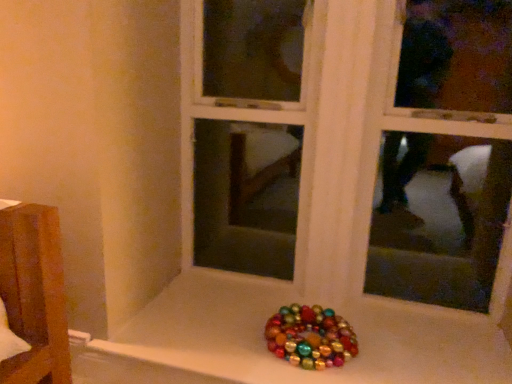
Measure the distance between point (346, 322) and camera.

Point (346, 322) is 5.42 feet from camera.

Where is `multicolored glossy beads at bottom center`? multicolored glossy beads at bottom center is located at coordinates (310, 337).

Describe the element at coordinates (310, 337) in the screenshot. The width and height of the screenshot is (512, 384). I see `multicolored glossy beads at bottom center` at that location.

The width and height of the screenshot is (512, 384). Describe the element at coordinates (342, 143) in the screenshot. I see `metallic shiny ornaments at bottom` at that location.

What is the approximate height of metallic shiny ornaments at bottom?

metallic shiny ornaments at bottom is 1.23 meters tall.

At what (x,y) coordinates should I click in order to perform the action: click on metallic shiny ornaments at bottom. Please return your answer as a coordinate pair (x, y). Looking at the image, I should click on (342, 143).

In order to click on multicolored glossy beads at bottom center in this screenshot , I will do `click(310, 337)`.

Considering the relative positions of multicolored glossy beads at bottom center and metallic shiny ornaments at bottom in the image provided, is multicolored glossy beads at bottom center to the left of metallic shiny ornaments at bottom from the viewer's perspective?

Indeed, multicolored glossy beads at bottom center is positioned on the left side of metallic shiny ornaments at bottom.

Considering the relative positions of multicolored glossy beads at bottom center and metallic shiny ornaments at bottom in the image provided, is multicolored glossy beads at bottom center behind metallic shiny ornaments at bottom?

Yes, it is behind metallic shiny ornaments at bottom.

Between point (276, 335) and point (405, 121), which one is positioned behind?

The point (405, 121) is farther.

From the image's perspective, does multicolored glossy beads at bottom center appear higher than metallic shiny ornaments at bottom?

Incorrect, from the image's perspective, multicolored glossy beads at bottom center is lower than metallic shiny ornaments at bottom.

From a real-world perspective, who is located lower, multicolored glossy beads at bottom center or metallic shiny ornaments at bottom?

In real-world perspective, multicolored glossy beads at bottom center is lower.

Can you confirm if multicolored glossy beads at bottom center is thinner than metallic shiny ornaments at bottom?

Incorrect, the width of multicolored glossy beads at bottom center is not less than that of metallic shiny ornaments at bottom.

Who is shorter, multicolored glossy beads at bottom center or metallic shiny ornaments at bottom?

multicolored glossy beads at bottom center.

Considering the relative sizes of multicolored glossy beads at bottom center and metallic shiny ornaments at bottom in the image provided, is multicolored glossy beads at bottom center smaller than metallic shiny ornaments at bottom?

Correct, multicolored glossy beads at bottom center occupies less space than metallic shiny ornaments at bottom.

Is multicolored glossy beads at bottom center located outside metallic shiny ornaments at bottom?

Indeed, multicolored glossy beads at bottom center is completely outside metallic shiny ornaments at bottom.

Is multicolored glossy beads at bottom center touching metallic shiny ornaments at bottom?

There is a gap between multicolored glossy beads at bottom center and metallic shiny ornaments at bottom.

In the scene shown: Does multicolored glossy beads at bottom center turn towards metallic shiny ornaments at bottom?

No, multicolored glossy beads at bottom center is not facing towards metallic shiny ornaments at bottom.

What's the angular difference between multicolored glossy beads at bottom center and metallic shiny ornaments at bottom's facing directions?

The angular difference between multicolored glossy beads at bottom center and metallic shiny ornaments at bottom is 0.626 degrees.

How much distance is there between multicolored glossy beads at bottom center and metallic shiny ornaments at bottom?

multicolored glossy beads at bottom center is 74.71 centimeters from metallic shiny ornaments at bottom.

Find the location of a particular element. This screenshot has width=512, height=384. bay window lying above the multicolored glossy beads at bottom center (from the image's perspective) is located at coordinates (342, 143).

Would you say metallic shiny ornaments at bottom is to the left or to the right of multicolored glossy beads at bottom center in the picture?

metallic shiny ornaments at bottom is to the right of multicolored glossy beads at bottom center.

Which is in front, metallic shiny ornaments at bottom or multicolored glossy beads at bottom center?

metallic shiny ornaments at bottom is closer to the camera.

Does point (276, 261) appear closer or farther from the camera than point (274, 330)?

Point (276, 261) is positioned farther from the camera compared to point (274, 330).

From the image's perspective, is metallic shiny ornaments at bottom positioned above or below multicolored glossy beads at bottom center?

Based on their image positions, metallic shiny ornaments at bottom is located above multicolored glossy beads at bottom center.

From a real-world perspective, does metallic shiny ornaments at bottom sit lower than multicolored glossy beads at bottom center?

Actually, metallic shiny ornaments at bottom is physically above multicolored glossy beads at bottom center in the real world.

Does metallic shiny ornaments at bottom have a lesser width compared to multicolored glossy beads at bottom center?

Correct, the width of metallic shiny ornaments at bottom is less than that of multicolored glossy beads at bottom center.

Which of these two, metallic shiny ornaments at bottom or multicolored glossy beads at bottom center, stands taller?

Standing taller between the two is metallic shiny ornaments at bottom.

Between metallic shiny ornaments at bottom and multicolored glossy beads at bottom center, which one has smaller size?

With smaller size is multicolored glossy beads at bottom center.

Is multicolored glossy beads at bottom center completely or partially inside metallic shiny ornaments at bottom?

Definitely not — multicolored glossy beads at bottom center is not inside metallic shiny ornaments at bottom.

Is metallic shiny ornaments at bottom not near multicolored glossy beads at bottom center?

metallic shiny ornaments at bottom is actually quite close to multicolored glossy beads at bottom center.

Is metallic shiny ornaments at bottom turned away from multicolored glossy beads at bottom center?

metallic shiny ornaments at bottom does not have its back to multicolored glossy beads at bottom center.

Can you tell me how much metallic shiny ornaments at bottom and multicolored glossy beads at bottom center differ in facing direction?

There is a 0.626-degree angle between the facing directions of metallic shiny ornaments at bottom and multicolored glossy beads at bottom center.

Where is `glass bead lying behind the metallic shiny ornaments at bottom`? glass bead lying behind the metallic shiny ornaments at bottom is located at coordinates (310, 337).

Where is `bay window above the multicolored glossy beads at bottom center (from the image's perspective)`? The height and width of the screenshot is (384, 512). bay window above the multicolored glossy beads at bottom center (from the image's perspective) is located at coordinates (342, 143).

The height and width of the screenshot is (384, 512). I want to click on bay window in front of the multicolored glossy beads at bottom center, so click(342, 143).